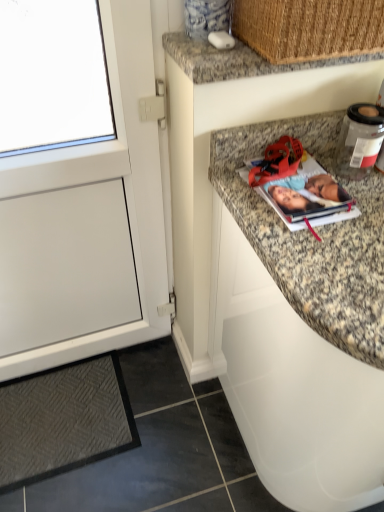
Find the location of `unoccupied region to the right of white matte cabinet at left, the 1th cabinetry when ordered from left to right`. unoccupied region to the right of white matte cabinet at left, the 1th cabinetry when ordered from left to right is located at coordinates (178, 398).